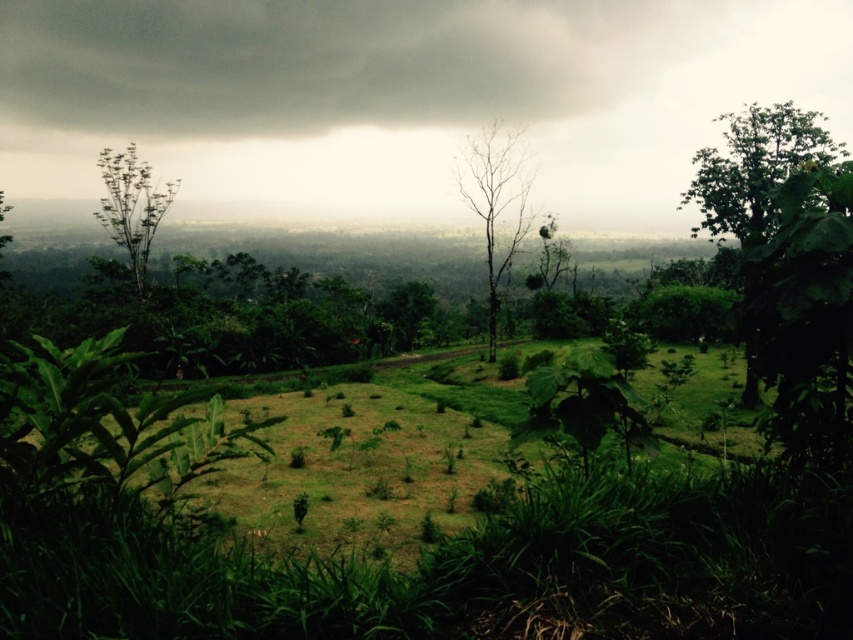
You are standing on the dirt path in the center of the image and want to walk toward the green leafy tree at left. Which direction should you go to avoid walking through the green leafy tree at right?

Since the green leafy tree at right is in front of the green leafy tree at left, you should walk towards the left side of the path to avoid the tree at right and reach the tree at left.